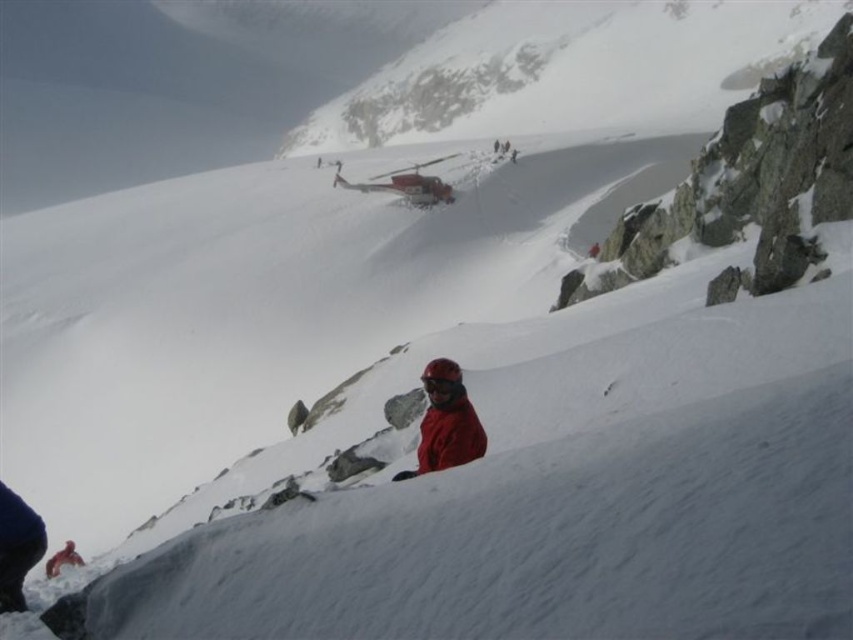
Does matte red jacket at center have a lesser width compared to red matte jacket at lower center?

Correct, matte red jacket at center's width is less than red matte jacket at lower center's.

Can you confirm if matte red jacket at center is taller than red matte jacket at lower center?

In fact, matte red jacket at center may be shorter than red matte jacket at lower center.

Identify the location of matte red jacket at center. The image size is (853, 640). (445, 420).

Identify the location of matte red jacket at center. The height and width of the screenshot is (640, 853). (445, 420).